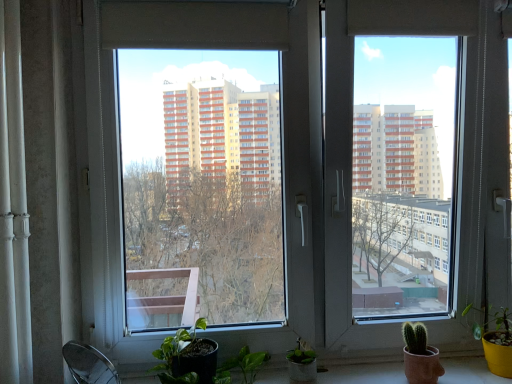
Question: Considering the relative positions of white glossy window sill at lower center and matte yellow pot at lower right in the image provided, is white glossy window sill at lower center in front of matte yellow pot at lower right?

Choices:
 (A) no
 (B) yes

Answer: (B)

Question: Can you confirm if white glossy window sill at lower center is shorter than matte yellow pot at lower right?

Choices:
 (A) yes
 (B) no

Answer: (A)

Question: Are white glossy window sill at lower center and matte yellow pot at lower right making contact?

Choices:
 (A) yes
 (B) no

Answer: (B)

Question: Can matte yellow pot at lower right be found inside white glossy window sill at lower center?

Choices:
 (A) no
 (B) yes

Answer: (A)

Question: Is white glossy window sill at lower center oriented away from matte yellow pot at lower right?

Choices:
 (A) yes
 (B) no

Answer: (B)

Question: Can you confirm if white glossy window sill at lower center is positioned to the left of matte yellow pot at lower right?

Choices:
 (A) no
 (B) yes

Answer: (B)

Question: Is transparent glass window at center thinner than white glossy curtain at left?

Choices:
 (A) yes
 (B) no

Answer: (B)

Question: Does transparent glass window at center have a greater height compared to white glossy curtain at left?

Choices:
 (A) no
 (B) yes

Answer: (B)

Question: From the image's perspective, is transparent glass window at center under white glossy curtain at left?

Choices:
 (A) yes
 (B) no

Answer: (B)

Question: From the image's perspective, is transparent glass window at center located above white glossy curtain at left?

Choices:
 (A) yes
 (B) no

Answer: (A)

Question: Is transparent glass window at center bigger than white glossy curtain at left?

Choices:
 (A) no
 (B) yes

Answer: (B)

Question: Is transparent glass window at center to the left of white glossy curtain at left from the viewer's perspective?

Choices:
 (A) no
 (B) yes

Answer: (A)

Question: From a real-world perspective, does transparent glass window at center stand above matte yellow pot at lower right?

Choices:
 (A) no
 (B) yes

Answer: (B)